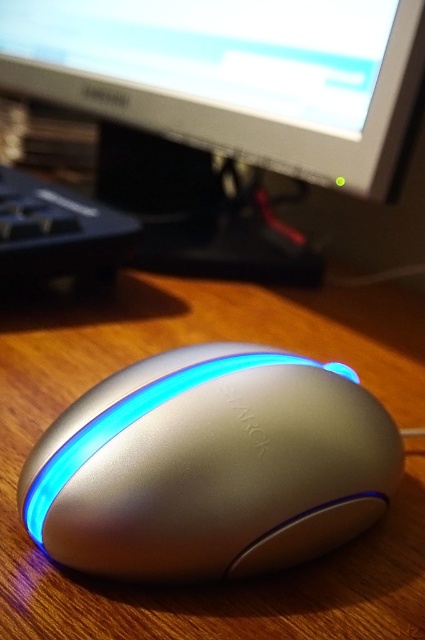
You are a graphic designer working on a project and need to reach for the satin silver mouse at center. If your hand is currently at point 0.728, 0.496, can you grab the mouse without moving your hand?

The satin silver mouse at center is located exactly at point (210,465), so yes, you can grab it without moving your hand.

You are setting up a new desk setup and need to place both the matte black monitor at upper center and the black plastic keyboard at lower left. Based on their sizes, which object should be positioned first to ensure proper placement?

The matte black monitor at upper center should be positioned first since it has a larger size compared to the black plastic keyboard at lower left, allowing for better spatial planning.

You are looking at the computer mouse and two points on the desk. Which point is closer to you, point (376,44) or point (294,472)?

Point (376,44) is closer to you than point (294,472).